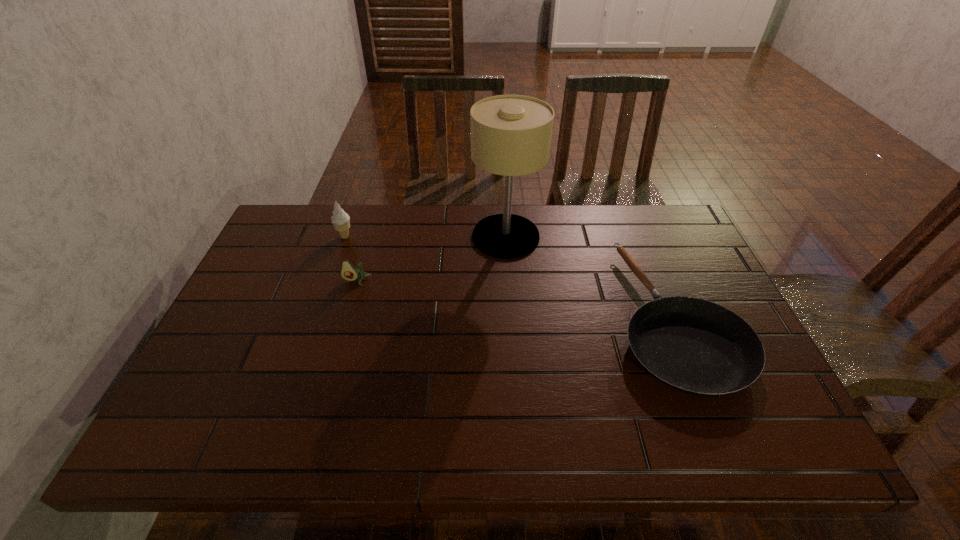
Image resolution: width=960 pixels, height=540 pixels. Find the location of `vacant space at the near left corner of the desktop`. vacant space at the near left corner of the desktop is located at coordinates (190, 448).

In order to click on free space between the icecream and the avocado in this screenshot , I will do `click(350, 259)`.

Find the location of a particular element. The image size is (960, 540). vacant area that lies between the avocado and the icecream is located at coordinates (350, 259).

Identify the location of empty space between the second object from right to left and the icecream. [425, 237].

Locate an element on the screen. Image resolution: width=960 pixels, height=540 pixels. vacant area that lies between the frying pan and the second tallest object is located at coordinates (510, 277).

I want to click on vacant space that's between the frying pan and the table lamp, so click(x=590, y=277).

At what (x,y) coordinates should I click in order to perform the action: click on unoccupied position between the rightmost object and the tallest object. Please return your answer as a coordinate pair (x, y). Looking at the image, I should click on (590, 277).

This screenshot has height=540, width=960. Find the location of `free point between the third object from right to left and the leftmost object`. free point between the third object from right to left and the leftmost object is located at coordinates (350, 259).

What are the coordinates of `unoccupied position between the icecream and the table lamp` in the screenshot? It's located at (425, 237).

The height and width of the screenshot is (540, 960). I want to click on vacant area between the icecream and the third object from left to right, so click(425, 237).